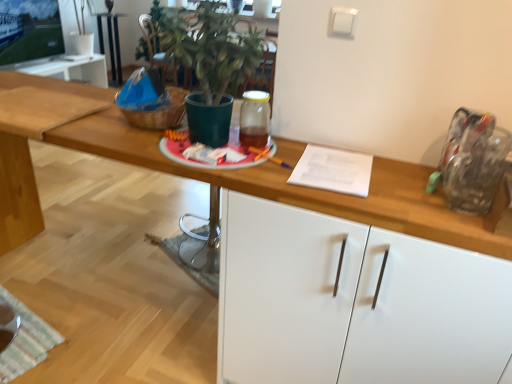
Question: Does green matte plant pot at center lie in front of white glossy cabinet at center?

Choices:
 (A) yes
 (B) no

Answer: (B)

Question: From the image's perspective, does green matte plant pot at center appear lower than white glossy cabinet at center?

Choices:
 (A) no
 (B) yes

Answer: (A)

Question: From a real-world perspective, is green matte plant pot at center positioned under white glossy cabinet at center based on gravity?

Choices:
 (A) no
 (B) yes

Answer: (A)

Question: Is green matte plant pot at center not inside white glossy cabinet at center?

Choices:
 (A) no
 (B) yes

Answer: (B)

Question: Considering the relative sizes of green matte plant pot at center and white glossy cabinet at center in the image provided, is green matte plant pot at center thinner than white glossy cabinet at center?

Choices:
 (A) no
 (B) yes

Answer: (B)

Question: Is point (163, 31) positioned closer to the camera than point (109, 4)?

Choices:
 (A) farther
 (B) closer

Answer: (B)

Question: Is green matte plant pot at center inside the boundaries of metallic silver table at center, or outside?

Choices:
 (A) inside
 (B) outside

Answer: (B)

Question: From a real-world perspective, is green matte plant pot at center above or below metallic silver table at center?

Choices:
 (A) below
 (B) above

Answer: (B)

Question: Based on their sizes in the image, would you say green matte plant pot at center is bigger or smaller than metallic silver table at center?

Choices:
 (A) small
 (B) big

Answer: (A)

Question: Based on their sizes in the image, would you say white glossy cabinet at center is bigger or smaller than metallic silver table at center?

Choices:
 (A) big
 (B) small

Answer: (A)

Question: From the image's perspective, is white glossy cabinet at center positioned above or below metallic silver table at center?

Choices:
 (A) above
 (B) below

Answer: (B)

Question: From a real-world perspective, is white glossy cabinet at center above or below metallic silver table at center?

Choices:
 (A) below
 (B) above

Answer: (B)

Question: Is white glossy cabinet at center taller or shorter than metallic silver table at center?

Choices:
 (A) tall
 (B) short

Answer: (A)

Question: In terms of height, does metallic silver table at center look taller or shorter compared to green matte plant pot at center?

Choices:
 (A) tall
 (B) short

Answer: (A)

Question: Is metallic silver table at center spatially inside green matte plant pot at center, or outside of it?

Choices:
 (A) outside
 (B) inside

Answer: (A)